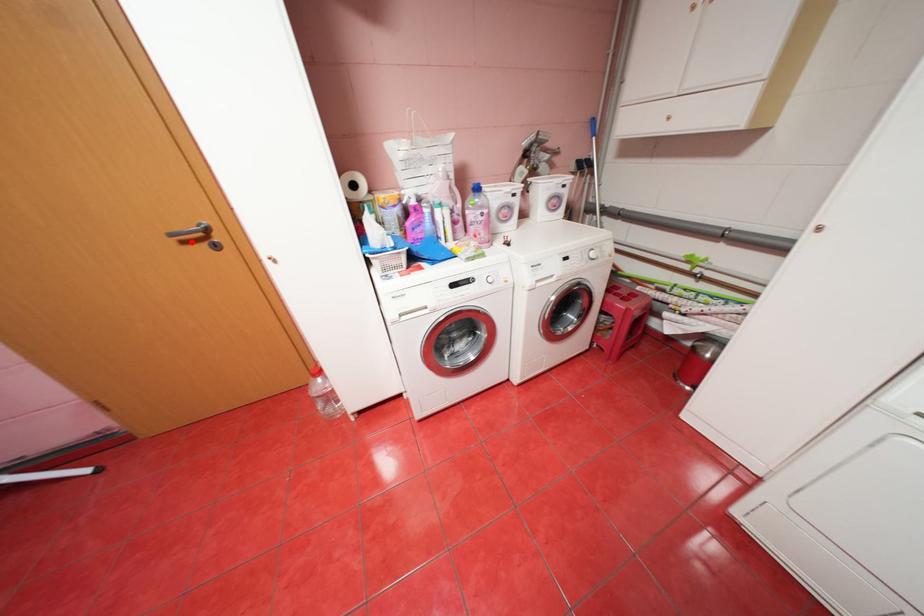
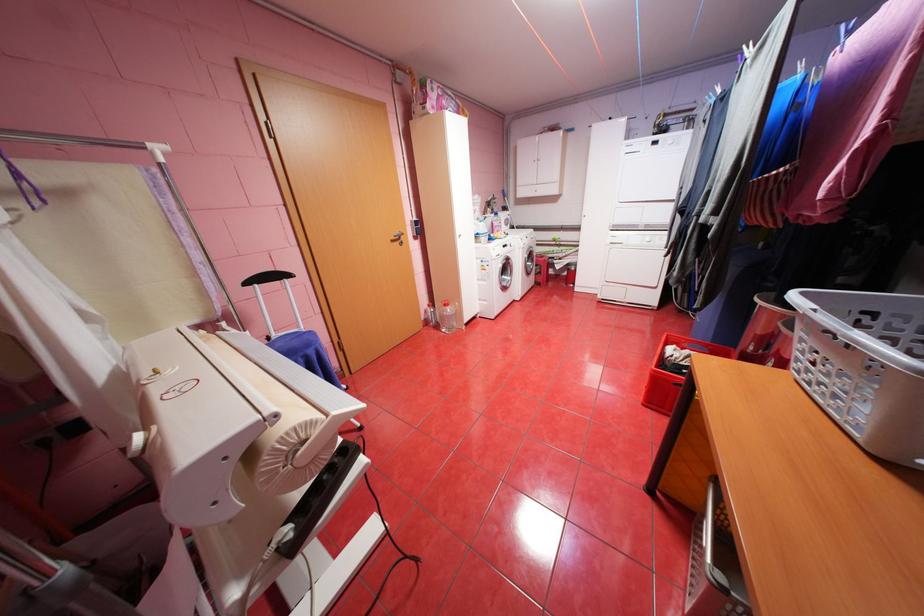
The point at the highlighted location is marked in the first image. Where is the corresponding point in the second image?

(400, 241)